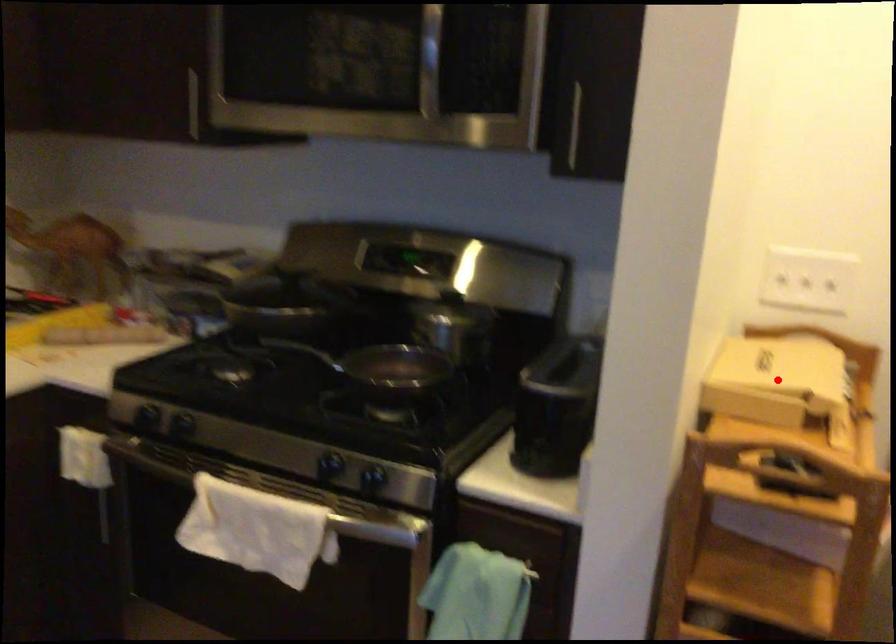
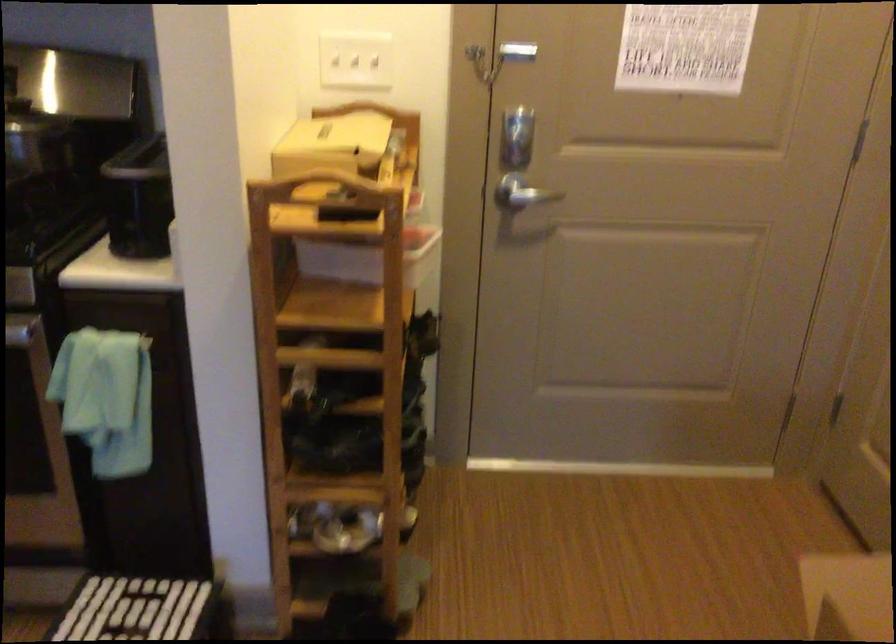
Question: I am providing you with two images of the same scene from different viewpoints. In image1, a red point is highlighted. Considering the same 3D point in image2, which of the following is correct?

Choices:
 (A) It is closer
 (B) It is farther

Answer: (B)